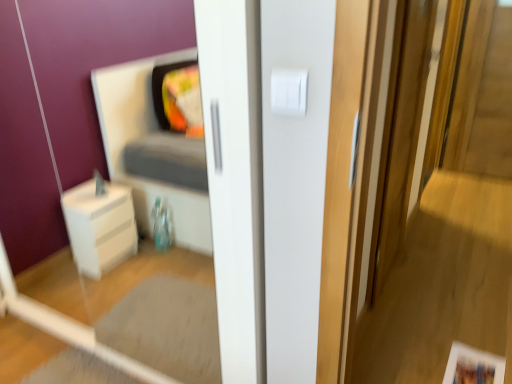
Question: Does wooden screen door at right appear on the left side of white plastic light switch at upper center?

Choices:
 (A) no
 (B) yes

Answer: (A)

Question: Considering the relative sizes of wooden screen door at right and white plastic light switch at upper center in the image provided, is wooden screen door at right shorter than white plastic light switch at upper center?

Choices:
 (A) yes
 (B) no

Answer: (B)

Question: Would you say wooden screen door at right is a long distance from white plastic light switch at upper center?

Choices:
 (A) no
 (B) yes

Answer: (B)

Question: Is wooden screen door at right next to white plastic light switch at upper center?

Choices:
 (A) yes
 (B) no

Answer: (B)

Question: Is wooden screen door at right at the right side of white plastic light switch at upper center?

Choices:
 (A) no
 (B) yes

Answer: (B)

Question: Is white plastic light switch at upper center at the back of wooden screen door at right?

Choices:
 (A) yes
 (B) no

Answer: (B)

Question: Are white plastic light switch at upper center and wooden screen door at right far apart?

Choices:
 (A) no
 (B) yes

Answer: (B)

Question: Can you confirm if white plastic light switch at upper center is smaller than wooden screen door at right?

Choices:
 (A) no
 (B) yes

Answer: (B)

Question: Is white plastic light switch at upper center taller than wooden screen door at right?

Choices:
 (A) no
 (B) yes

Answer: (A)

Question: Does white plastic light switch at upper center have a greater width compared to wooden screen door at right?

Choices:
 (A) no
 (B) yes

Answer: (A)

Question: Is white plastic light switch at upper center oriented away from wooden screen door at right?

Choices:
 (A) no
 (B) yes

Answer: (A)

Question: Does white plastic light switch at upper center have a lesser height compared to wooden screen door at right?

Choices:
 (A) yes
 (B) no

Answer: (A)

Question: Does point (294, 114) appear closer or farther from the camera than point (398, 150)?

Choices:
 (A) closer
 (B) farther

Answer: (A)